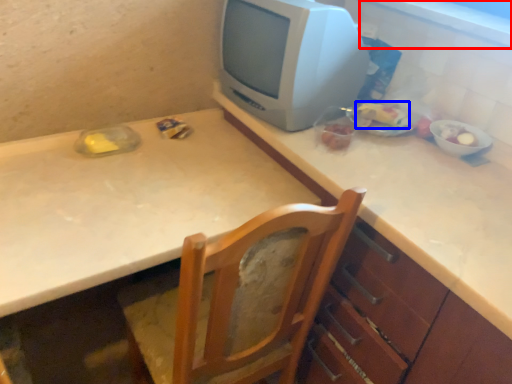
Question: Among these objects, which one is nearest to the camera, window sill (highlighted by a red box) or food (highlighted by a blue box)?

Choices:
 (A) window sill
 (B) food

Answer: (A)